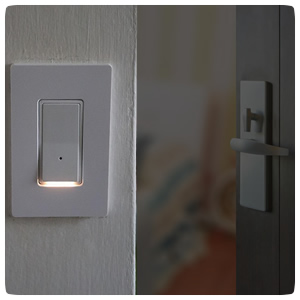
Where is `floor`? floor is located at coordinates (212, 273).